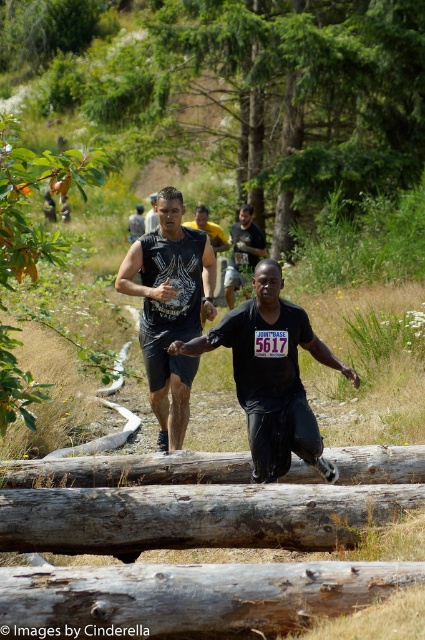
What are the coordinates of the black matte shirt at center?

The coordinates of the black matte shirt at center are at point [272,374].